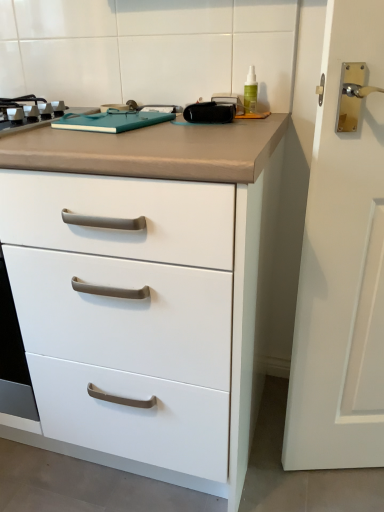
Question: From the image's perspective, is green translucent bottle at upper right located above white matte chest of drawers at center?

Choices:
 (A) no
 (B) yes

Answer: (B)

Question: Is green translucent bottle at upper right at the right side of white matte chest of drawers at center?

Choices:
 (A) no
 (B) yes

Answer: (B)

Question: Is green translucent bottle at upper right looking in the opposite direction of white matte chest of drawers at center?

Choices:
 (A) yes
 (B) no

Answer: (B)

Question: Can you confirm if green translucent bottle at upper right is thinner than white matte chest of drawers at center?

Choices:
 (A) no
 (B) yes

Answer: (B)

Question: Could white matte chest of drawers at center be considered to be inside green translucent bottle at upper right?

Choices:
 (A) no
 (B) yes

Answer: (A)

Question: From a real-world perspective, is metallic gray gas stove at upper left above or below white matte chest of drawers at center?

Choices:
 (A) above
 (B) below

Answer: (A)

Question: Is point (26, 102) closer or farther from the camera than point (170, 169)?

Choices:
 (A) farther
 (B) closer

Answer: (A)

Question: Is metallic gray gas stove at upper left in front of or behind white matte chest of drawers at center in the image?

Choices:
 (A) behind
 (B) front

Answer: (A)

Question: Considering the positions of metallic gray gas stove at upper left and white matte chest of drawers at center in the image, is metallic gray gas stove at upper left wider or thinner than white matte chest of drawers at center?

Choices:
 (A) thin
 (B) wide

Answer: (A)

Question: From the image's perspective, is green translucent bottle at upper right located above or below metallic gray gas stove at upper left?

Choices:
 (A) below
 (B) above

Answer: (B)

Question: Considering the positions of point (244, 82) and point (11, 119), is point (244, 82) closer or farther from the camera than point (11, 119)?

Choices:
 (A) closer
 (B) farther

Answer: (B)

Question: Is green translucent bottle at upper right inside or outside of metallic gray gas stove at upper left?

Choices:
 (A) outside
 (B) inside

Answer: (A)

Question: Is green translucent bottle at upper right in front of or behind metallic gray gas stove at upper left in the image?

Choices:
 (A) front
 (B) behind

Answer: (B)

Question: Looking at their shapes, would you say white matte chest of drawers at center is wider or thinner than metallic gray gas stove at upper left?

Choices:
 (A) thin
 (B) wide

Answer: (B)

Question: Would you say white matte chest of drawers at center is to the left or to the right of metallic gray gas stove at upper left in the picture?

Choices:
 (A) right
 (B) left

Answer: (A)